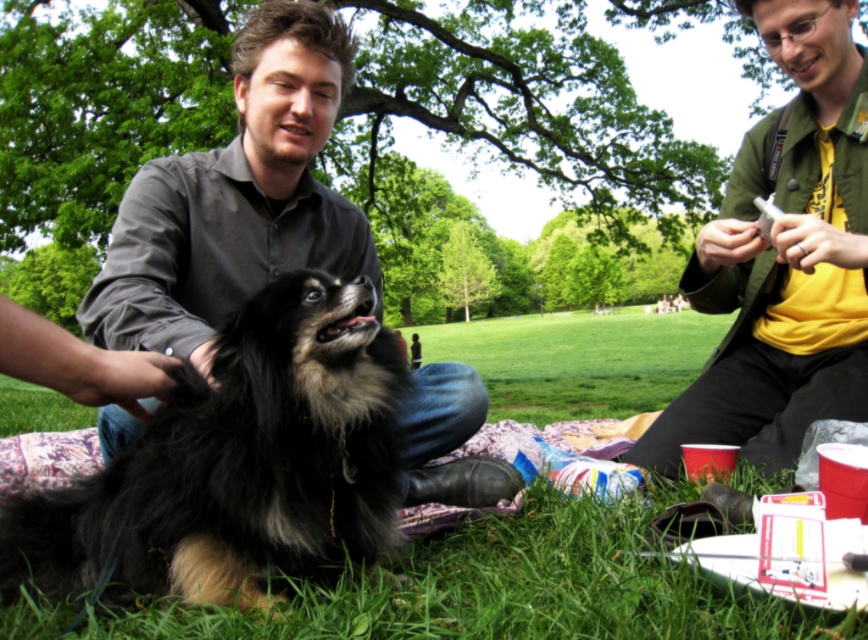
How much distance is there between fluffy fur dog at center and yellow cotton shirt at upper right?

fluffy fur dog at center and yellow cotton shirt at upper right are 8.52 feet apart.

Which is below, fluffy fur dog at center or yellow cotton shirt at upper right?

Positioned lower is fluffy fur dog at center.

Where is `fluffy fur dog at center`? The height and width of the screenshot is (640, 868). fluffy fur dog at center is located at coordinates (237, 467).

Is dark gray shirt at center thinner than yellow cotton shirt at upper right?

Indeed, dark gray shirt at center has a lesser width compared to yellow cotton shirt at upper right.

Between dark gray shirt at center and yellow cotton shirt at upper right, which one has less height?

Standing shorter between the two is dark gray shirt at center.

Who is more forward, (162, 337) or (654, 310)?

Point (162, 337) is in front.

The height and width of the screenshot is (640, 868). What are the coordinates of `dark gray shirt at center` in the screenshot? It's located at (235, 198).

Between green grass at lower center and green matte jacket at upper right, which one appears on the right side from the viewer's perspective?

green grass at lower center is more to the right.

Can you confirm if green grass at lower center is positioned to the right of green matte jacket at upper right?

Indeed, green grass at lower center is positioned on the right side of green matte jacket at upper right.

Does point (337, 636) come closer to viewer compared to point (786, 305)?

That is True.

Locate an element on the screen. Image resolution: width=868 pixels, height=640 pixels. green grass at lower center is located at coordinates (514, 588).